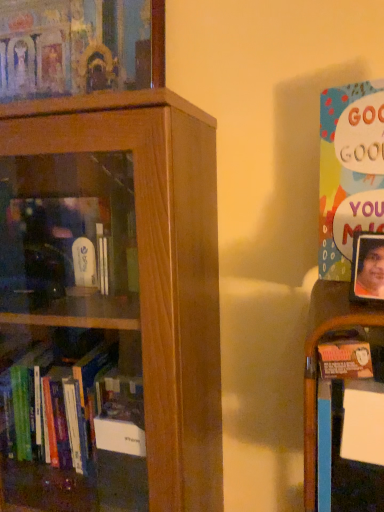
Question: Could wooden shelf at right be considered to be inside brown wooden bookcase at left?

Choices:
 (A) yes
 (B) no

Answer: (B)

Question: From a real-world perspective, does brown wooden bookcase at left sit lower than wooden shelf at right?

Choices:
 (A) no
 (B) yes

Answer: (B)

Question: Is brown wooden bookcase at left to the left of wooden shelf at right from the viewer's perspective?

Choices:
 (A) no
 (B) yes

Answer: (B)

Question: Is brown wooden bookcase at left bigger than wooden shelf at right?

Choices:
 (A) yes
 (B) no

Answer: (A)

Question: Considering the relative sizes of brown wooden bookcase at left and wooden shelf at right in the image provided, is brown wooden bookcase at left taller than wooden shelf at right?

Choices:
 (A) yes
 (B) no

Answer: (A)

Question: Does brown wooden bookcase at left have a lesser height compared to wooden shelf at right?

Choices:
 (A) no
 (B) yes

Answer: (A)

Question: Can you confirm if matte wooden frame at upper left, acting as the 1th book starting from the top, is thinner than wooden shelf at right?

Choices:
 (A) no
 (B) yes

Answer: (B)

Question: From a real-world perspective, does matte wooden frame at upper left, the 2th book viewed from the right, sit lower than wooden shelf at right?

Choices:
 (A) yes
 (B) no

Answer: (B)

Question: Does matte wooden frame at upper left, the 2th book viewed from the right, have a greater width compared to wooden shelf at right?

Choices:
 (A) yes
 (B) no

Answer: (B)

Question: Is the depth of matte wooden frame at upper left, which is counted as the second book, starting from the bottom, less than that of wooden shelf at right?

Choices:
 (A) no
 (B) yes

Answer: (A)

Question: Are matte wooden frame at upper left, acting as the 1th book starting from the top, and wooden shelf at right far apart?

Choices:
 (A) no
 (B) yes

Answer: (A)

Question: Does matte wooden frame at upper left, the 2th book viewed from the right, have a greater height compared to wooden shelf at right?

Choices:
 (A) no
 (B) yes

Answer: (A)

Question: From the image's perspective, would you say brown wooden bookcase at left is shown under matte wooden frame at upper left, acting as the 1th book starting from the top?

Choices:
 (A) yes
 (B) no

Answer: (A)